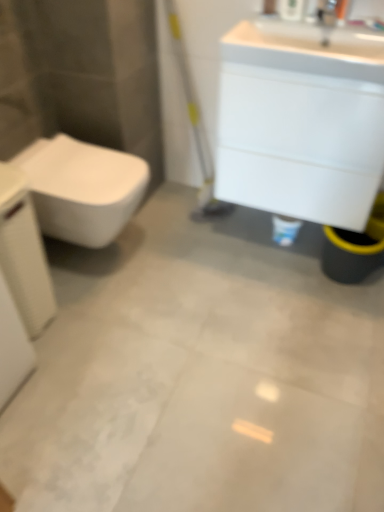
Question: Can you confirm if white textured porcelain at left is shorter than silver metallic faucet at upper right?

Choices:
 (A) no
 (B) yes

Answer: (A)

Question: Is white textured porcelain at left to the right of silver metallic faucet at upper right from the viewer's perspective?

Choices:
 (A) no
 (B) yes

Answer: (A)

Question: Does white textured porcelain at left come behind silver metallic faucet at upper right?

Choices:
 (A) no
 (B) yes

Answer: (A)

Question: Considering the relative sizes of white textured porcelain at left and silver metallic faucet at upper right in the image provided, is white textured porcelain at left bigger than silver metallic faucet at upper right?

Choices:
 (A) no
 (B) yes

Answer: (B)

Question: From a real-world perspective, is white textured porcelain at left located beneath silver metallic faucet at upper right?

Choices:
 (A) no
 (B) yes

Answer: (B)

Question: From the image's perspective, is white textured porcelain at left over silver metallic faucet at upper right?

Choices:
 (A) yes
 (B) no

Answer: (B)

Question: Is white glossy cabinet at upper right turned away from white textured porcelain at left?

Choices:
 (A) yes
 (B) no

Answer: (B)

Question: Does white glossy cabinet at upper right turn towards white textured porcelain at left?

Choices:
 (A) yes
 (B) no

Answer: (B)

Question: Is white glossy cabinet at upper right taller than white textured porcelain at left?

Choices:
 (A) no
 (B) yes

Answer: (A)

Question: Is white glossy cabinet at upper right bigger than white textured porcelain at left?

Choices:
 (A) no
 (B) yes

Answer: (B)

Question: From a real-world perspective, is white glossy cabinet at upper right physically below white textured porcelain at left?

Choices:
 (A) yes
 (B) no

Answer: (B)

Question: Is the position of white glossy cabinet at upper right more distant than that of white textured porcelain at left?

Choices:
 (A) yes
 (B) no

Answer: (A)

Question: From the image's perspective, does white glossy cabinet at upper right appear lower than white glossy toilet at left?

Choices:
 (A) no
 (B) yes

Answer: (A)